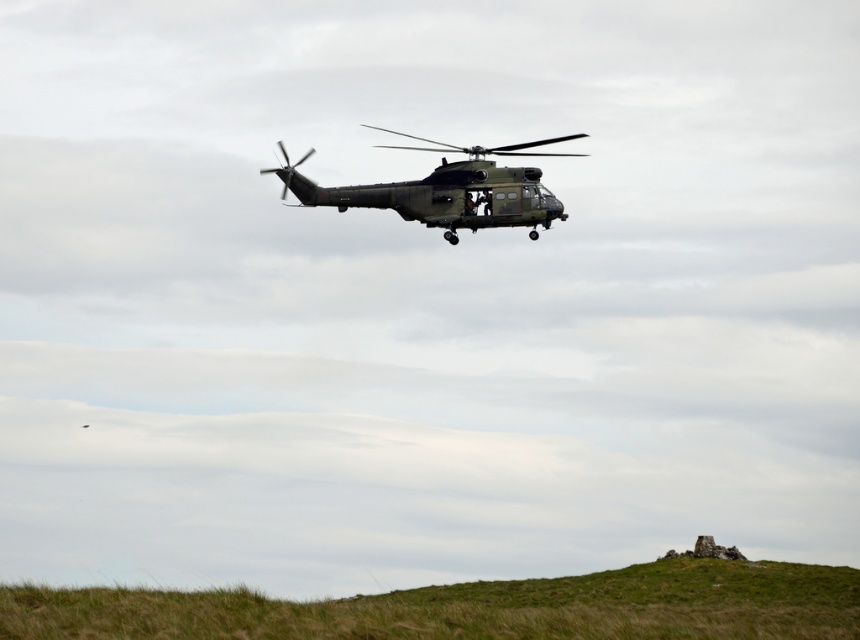
Question: Does green grassy hill at lower center appear on the left side of matte green helicopter at center?

Choices:
 (A) no
 (B) yes

Answer: (A)

Question: Which point appears farthest from the camera in this image?

Choices:
 (A) (473, 192)
 (B) (812, 616)

Answer: (A)

Question: Is green grassy hill at lower center bigger than matte green helicopter at center?

Choices:
 (A) yes
 (B) no

Answer: (A)

Question: Does green grassy hill at lower center have a greater width compared to matte green helicopter at center?

Choices:
 (A) no
 (B) yes

Answer: (B)